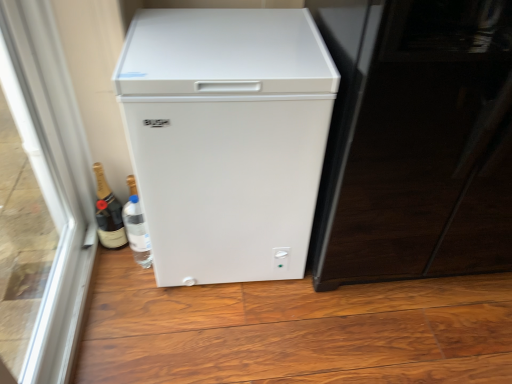
Where is `free space above white matte refrigerator at center (from a real-world perspective)`? The width and height of the screenshot is (512, 384). free space above white matte refrigerator at center (from a real-world perspective) is located at coordinates (229, 39).